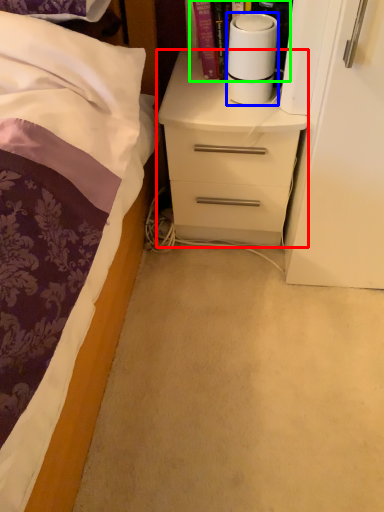
Question: Based on their relative distances, which object is farther from chest of drawers (highlighted by a red box)? Choose from paper towel (highlighted by a blue box) and book (highlighted by a green box).

Choices:
 (A) paper towel
 (B) book

Answer: (B)